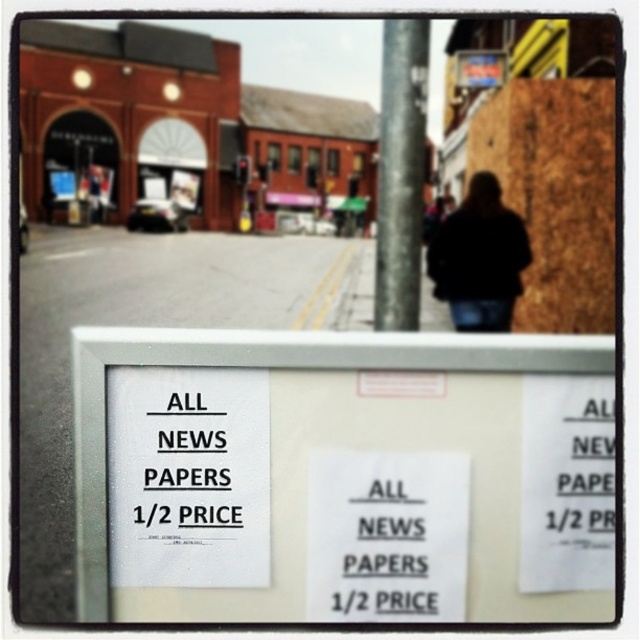
Question: Can you confirm if white paper sign at lower center is positioned to the right of silver metallic pole at center?

Choices:
 (A) no
 (B) yes

Answer: (A)

Question: Which point is closer to the camera?

Choices:
 (A) (240, 316)
 (B) (355, 426)

Answer: (A)

Question: Which object is the closest to the white paper sign at center?

Choices:
 (A) black fabric at center
 (B) silver metallic pole at center
 (C) white paper sign at lower center

Answer: (C)

Question: Can you confirm if white paper sign at center is wider than white paper sign at lower center?

Choices:
 (A) no
 (B) yes

Answer: (B)

Question: Which object is closer to the camera taking this photo?

Choices:
 (A) white paper sign at center
 (B) black fabric at center
 (C) white paper sign at lower center
 (D) silver metallic pole at center

Answer: (D)

Question: Is white paper sign at center above white paper sign at lower center?

Choices:
 (A) no
 (B) yes

Answer: (A)